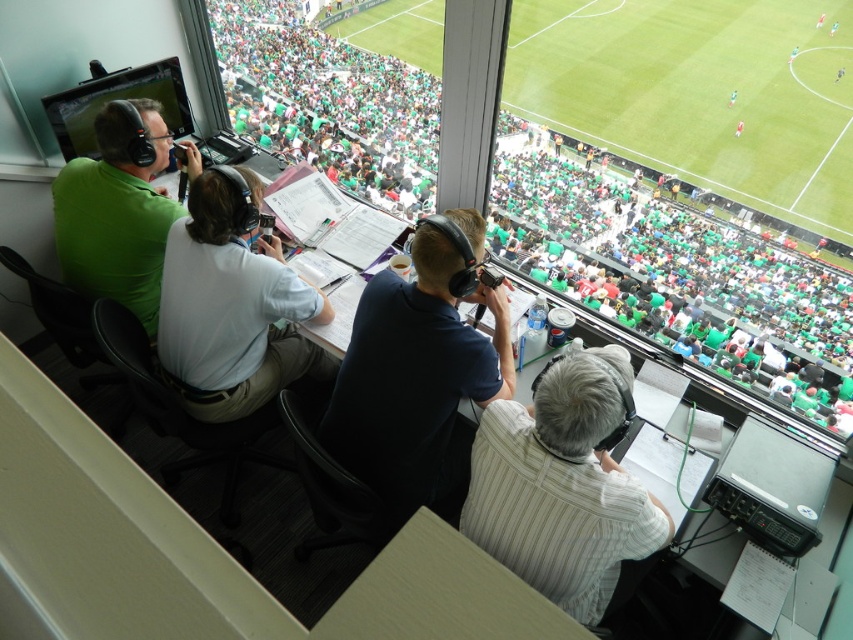
You are a technician in the broadcasting booth who needs to pass a microphone from the dark blue shirt at center to the green matte shirt at upper left. Given that the minimum safe distance for passing equipment without dropping is 1 meter, can you safely hand it over without needing to move either person?

The dark blue shirt at center and green matte shirt at upper left are 1.07 meters apart. Since the minimum safe distance is 1 meter, the technician can safely hand over the microphone as the distance is sufficient.

You are a technician adjusting the camera angles to ensure all commentators are visible. The camera currently focuses on the white cotton shirt at center and the green matte shirt at upper left. Which shirt should you adjust the camera to focus on first if you need to prioritize the taller commentator?

The green matte shirt at upper left is taller than the white cotton shirt at center, so you should adjust the camera to focus on the green matte shirt at upper left first.

You are a camera operator in the sports broadcast booth. You need to pan your camera from the green matte shirt at upper left to the dark blue shirt at center. In which direction should you move the camera?

The dark blue shirt at center is to the right of the green matte shirt at upper left, so you should move the camera to the right to pan from the green matte shirt at upper left to the dark blue shirt at center.